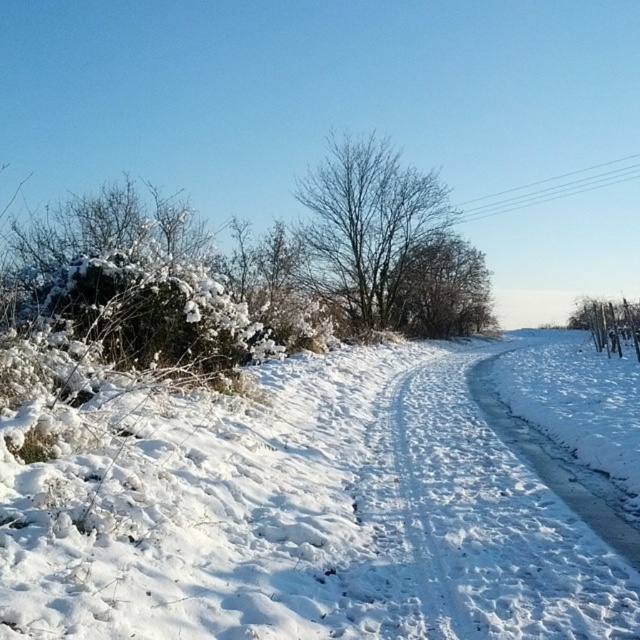
You are standing at the starting point of the snow path and want to reach the point marked as point (636,602). There is another point marked as point (616,339) along the way. Which point should you reach first?

You should reach point (636,602) first because it is in front of point (616,339) along the path.

You are a hiker who wants to step on the snow. Which of the two snow areas, the white fluffy snow at center or the white snow at center, would you choose to step on to avoid sinking deeper?

The white fluffy snow at center is above the white snow at center. Since fluffy snow is typically less compacted and more prone to sinking, stepping on the lower white snow at center would be better to avoid sinking deeper.

You are a hiker carrying a 20 meter long rope. You want to tie the white snow at center to the bare branches at center using the rope. Will the rope be long enough?

The distance between the white snow at center and the bare branches at center is 17.93 meters. Since the rope is 20 meters long, it is longer than the distance between them, so the rope will be long enough to tie them together.